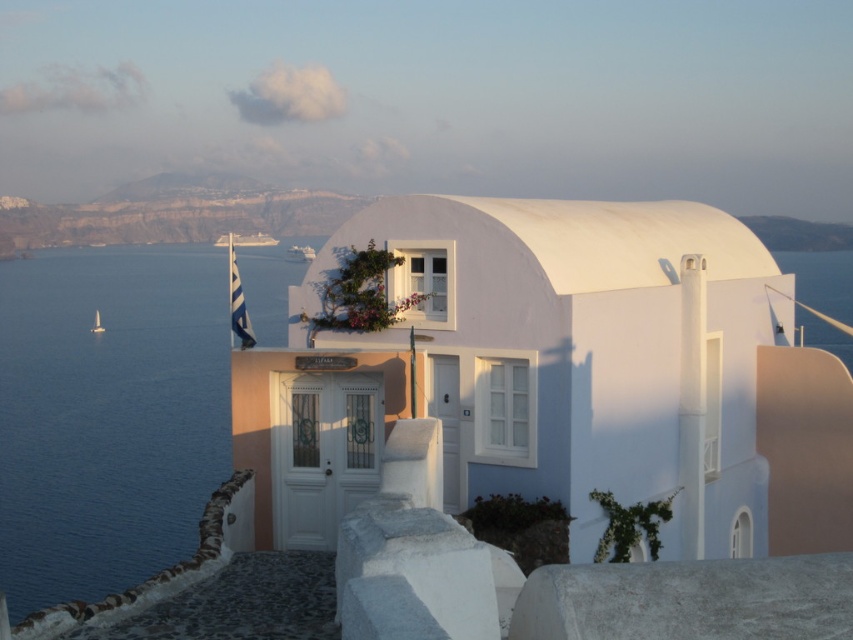
Question: Can you confirm if white matte building at center is thinner than blue water at left?

Choices:
 (A) no
 (B) yes

Answer: (B)

Question: Which point appears closest to the camera in this image?

Choices:
 (A) (4, 273)
 (B) (654, 285)

Answer: (B)

Question: Can you confirm if white matte building at center is positioned to the right of blue water at left?

Choices:
 (A) yes
 (B) no

Answer: (A)

Question: Among these objects, which one is nearest to the camera?

Choices:
 (A) white matte building at center
 (B) blue water at left

Answer: (A)

Question: Is white matte building at center below blue water at left?

Choices:
 (A) yes
 (B) no

Answer: (A)

Question: Among these points, which one is nearest to the camera?

Choices:
 (A) click(x=173, y=310)
 (B) click(x=828, y=356)

Answer: (B)